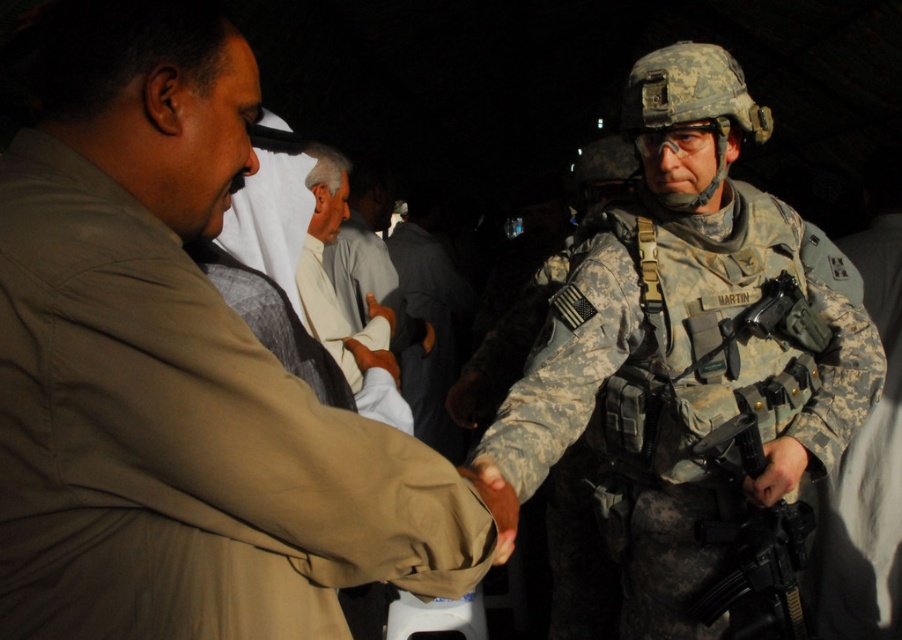
In the scene shown: Can you confirm if tan fabric shirt at center is positioned to the left of black matte rifle at right?

Indeed, tan fabric shirt at center is positioned on the left side of black matte rifle at right.

Locate an element on the screen. This screenshot has width=902, height=640. tan fabric shirt at center is located at coordinates (177, 372).

At what (x,y) coordinates should I click in order to perform the action: click on tan fabric shirt at center. Please return your answer as a coordinate pair (x, y). Looking at the image, I should click on (177, 372).

Is camouflage fabric uniform at right to the right of matte black gun at lower right from the viewer's perspective?

No, camouflage fabric uniform at right is not to the right of matte black gun at lower right.

Identify the location of camouflage fabric uniform at right. The height and width of the screenshot is (640, 902). (686, 385).

Can you confirm if camouflage fabric uniform at right is shorter than black matte rifle at right?

No, camouflage fabric uniform at right is not shorter than black matte rifle at right.

Based on the photo, can you confirm if camouflage fabric uniform at right is positioned to the right of black matte rifle at right?

Incorrect, camouflage fabric uniform at right is not on the right side of black matte rifle at right.

The image size is (902, 640). Describe the element at coordinates (686, 385) in the screenshot. I see `camouflage fabric uniform at right` at that location.

Identify the location of camouflage fabric uniform at right. Image resolution: width=902 pixels, height=640 pixels. (686, 385).